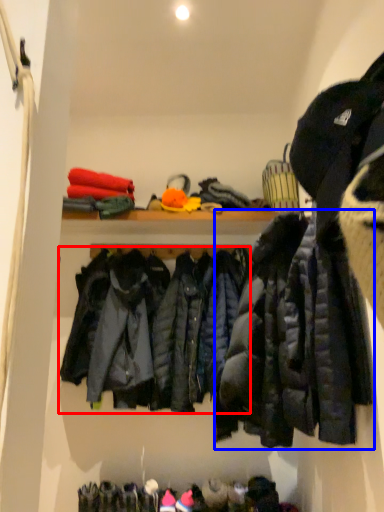
Question: Which point is closer to the camera, jacket (highlighted by a red box) or jacket (highlighted by a blue box)?

Choices:
 (A) jacket
 (B) jacket

Answer: (B)